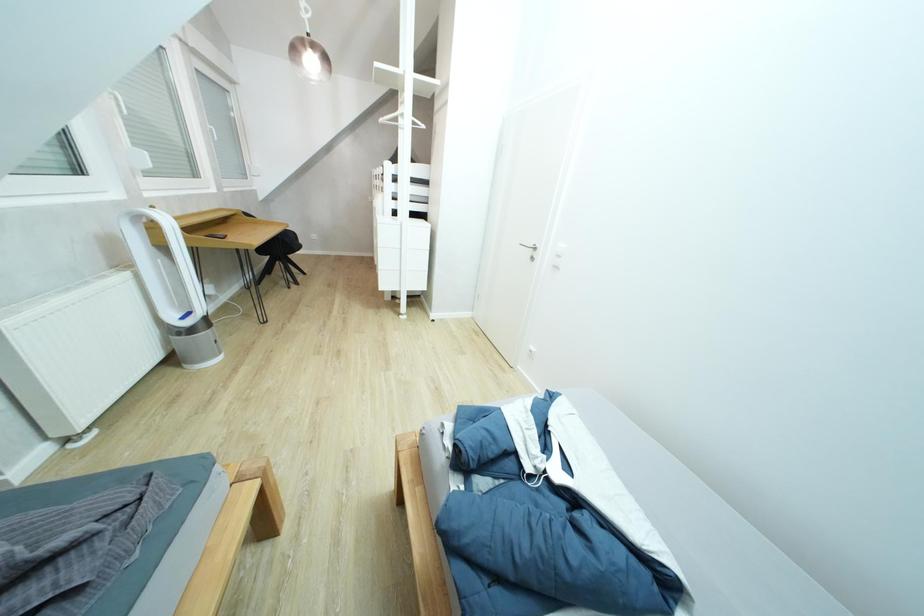
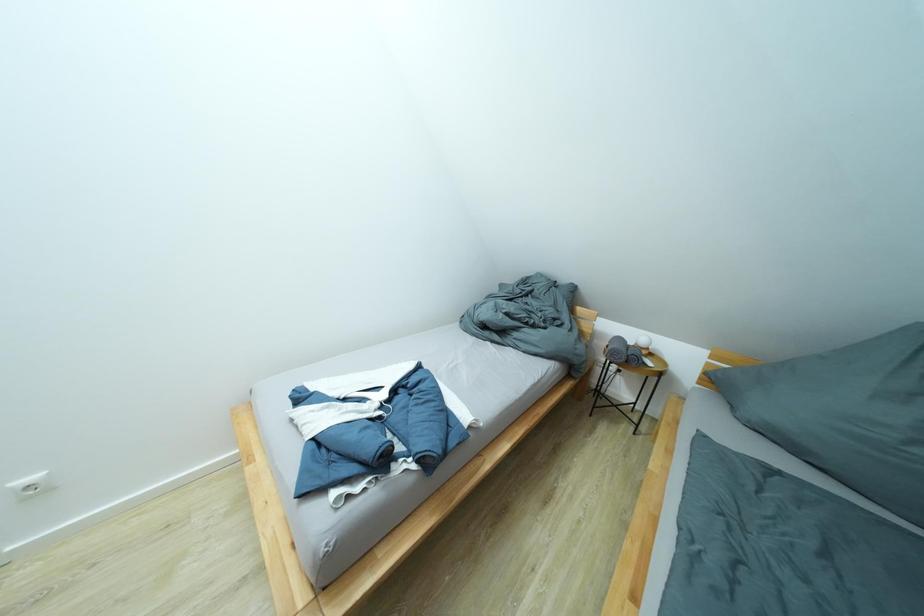
The first image is from the beginning of the video and the second image is from the end. How did the camera likely rotate when shooting the video?

The camera rotated toward right-down.